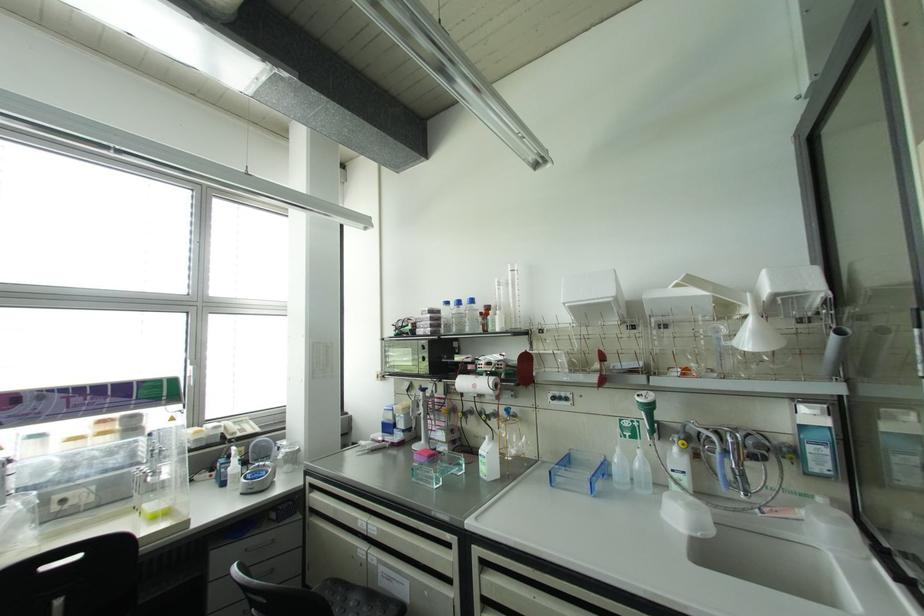
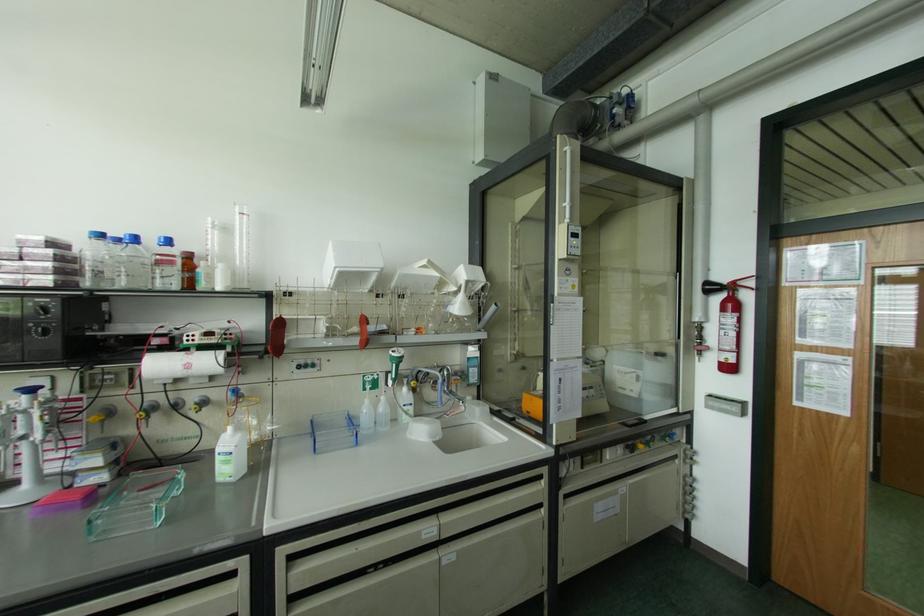
The point at (423, 359) is marked in the first image. Where is the corresponding point in the second image?

(44, 333)